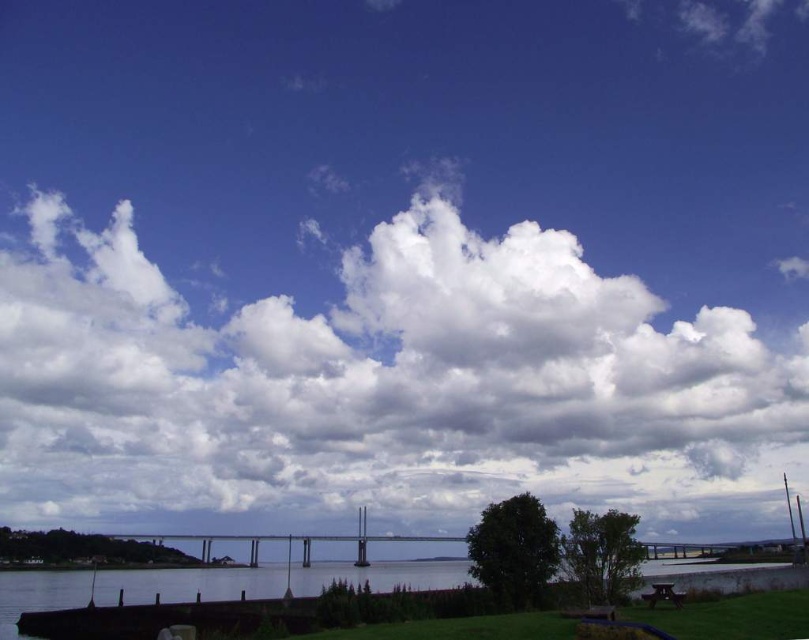
You are standing at the picnic table on the right side of the image and want to look up at the sky. Which object at point (382, 387) is directly above you?

The white fluffy cloud at upper center is located at point (382, 387), so it is directly above the picnic table on the right side.

You are standing at the picnic table on the right side of the image and want to point to the white fluffy cloud at upper center. In which direction should you look relative to the bridge?

The white fluffy cloud at upper center is located at point coordinates, so you should look towards the upper center direction relative to the bridge.

You are an astronomer observing the sky in the scene. You need to determine the exact location of the white fluffy cloud at upper center. What are its coordinates?

The white fluffy cloud at upper center is located at coordinates point (x=382, y=387).